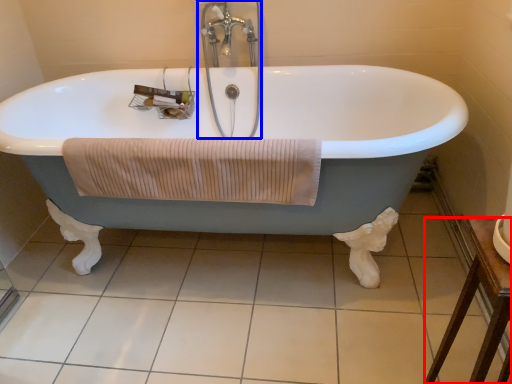
Question: Which object appears closest to the camera in this image, furniture (highlighted by a red box) or faucet (highlighted by a blue box)?

Choices:
 (A) furniture
 (B) faucet

Answer: (A)